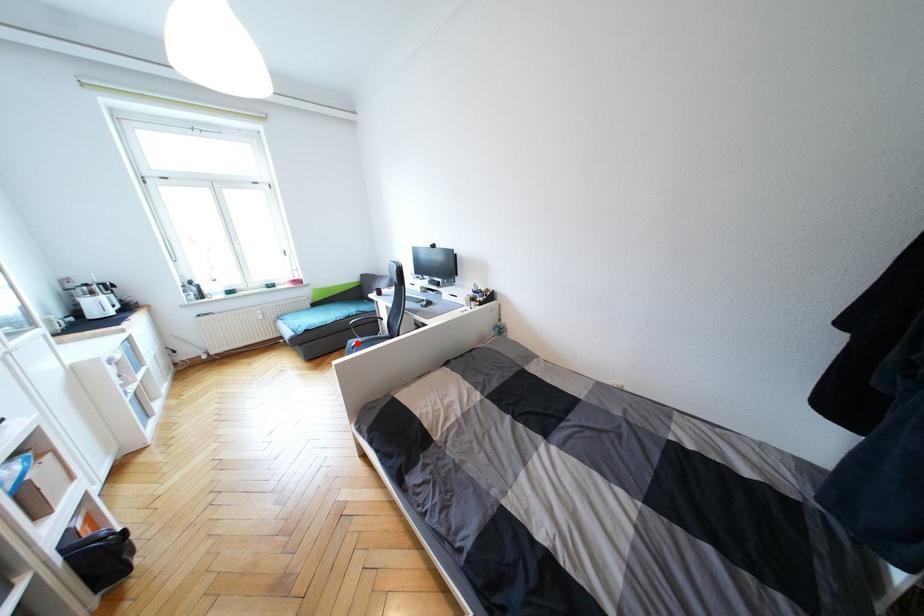
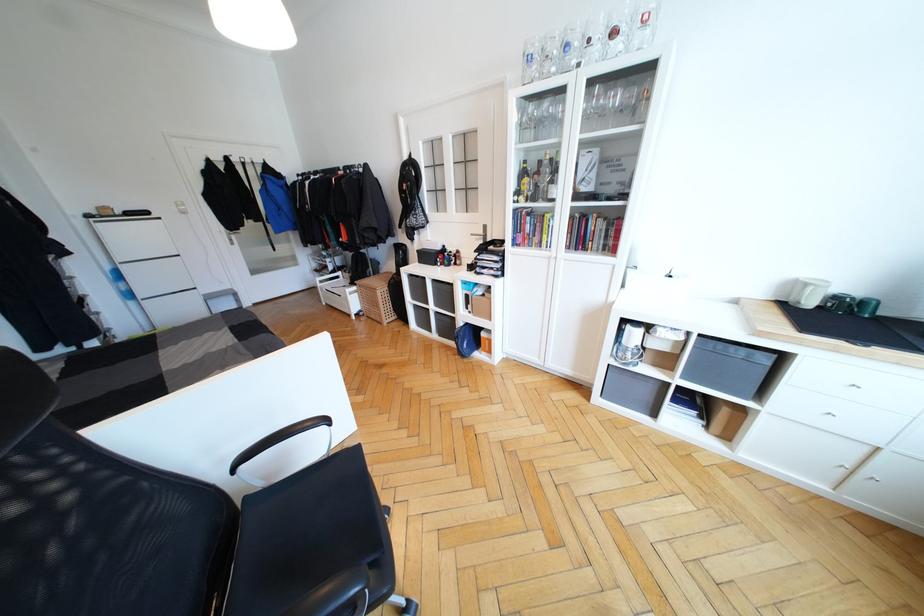
Question: I am providing you with two images of the same scene from different viewpoints. A red point is marked on the first image. At the location where the point appears in image 1, is it still visible in image 2?

Choices:
 (A) Yes
 (B) No

Answer: (B)